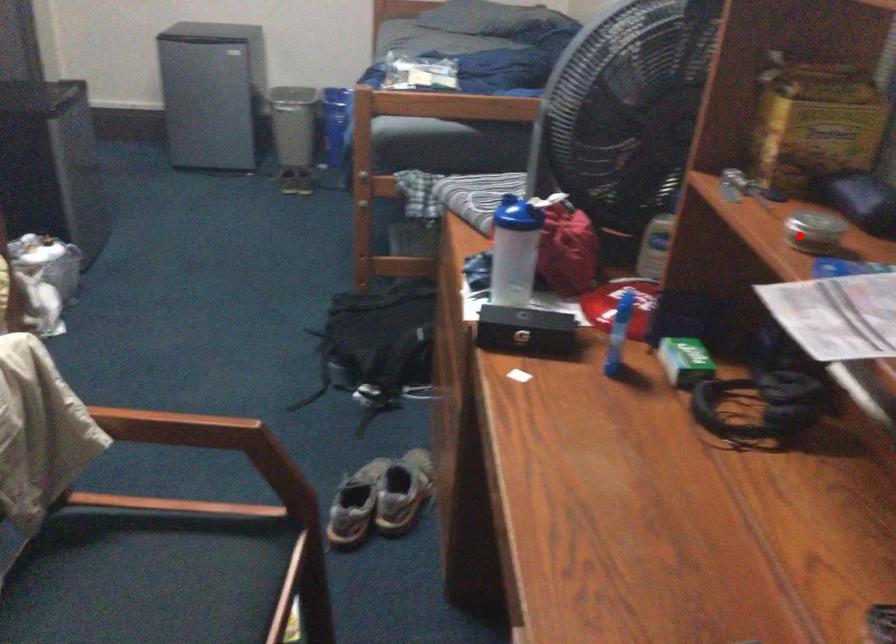
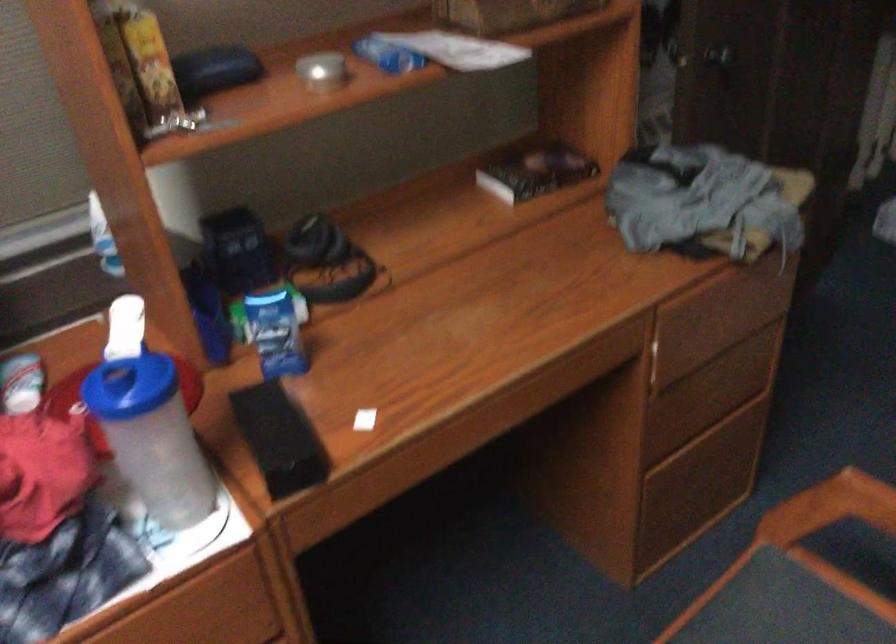
Question: I am providing you with two images of the same scene from different viewpoints. Given a red point in image1, look at the same physical point in image2. Is it:

Choices:
 (A) Closer to the viewpoint
 (B) Farther from the viewpoint

Answer: (B)